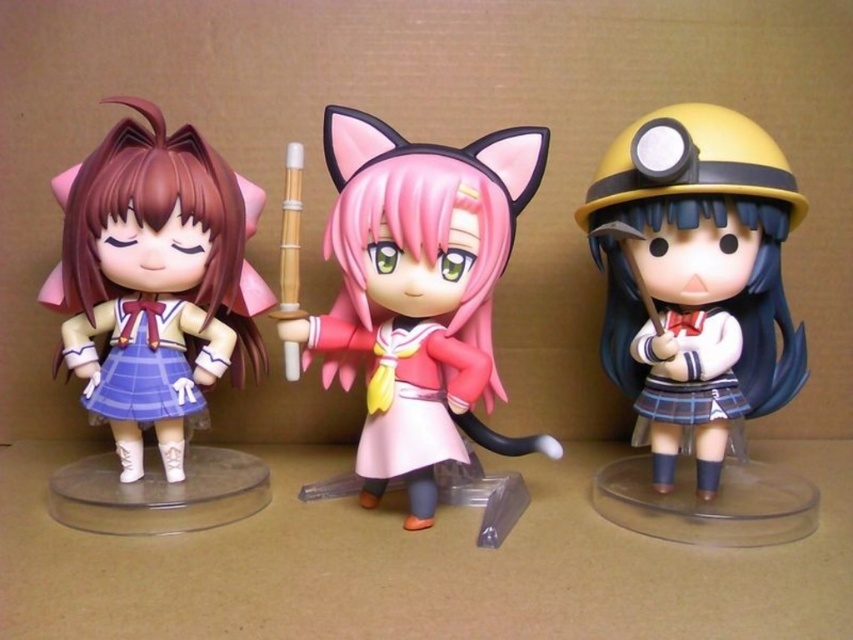
You are a collector who wants to display the matte yellow helmet at right and the matte plastic doll at left on a shelf. Which object should be placed at the back to avoid blocking the view of the shorter one?

The matte yellow helmet at right is taller than the matte plastic doll at left, so the matte yellow helmet at right should be placed at the back to avoid blocking the view of the shorter one.